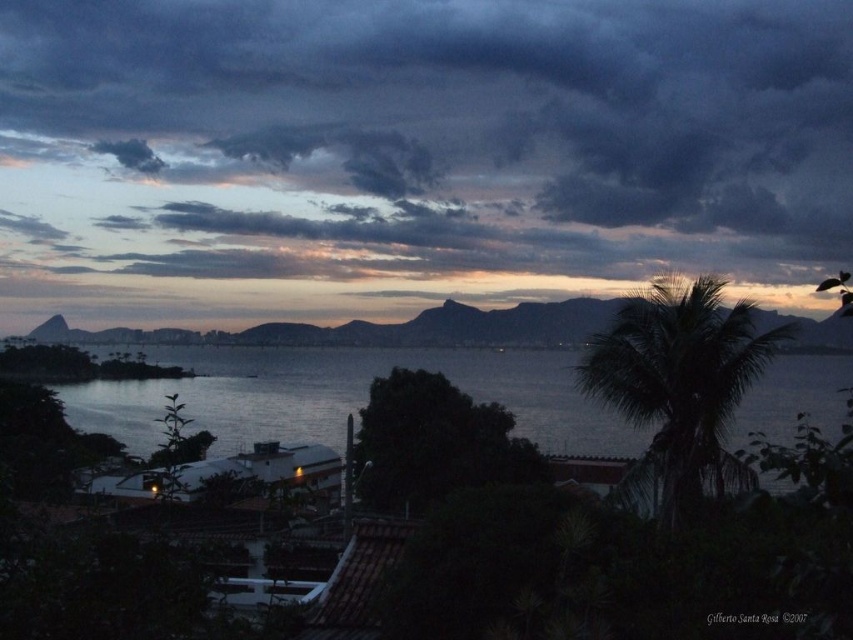
Question: Is dark gray cloud at upper center closer to the viewer compared to dark green leafy palm tree at right?

Choices:
 (A) yes
 (B) no

Answer: (B)

Question: Which point appears farthest from the camera in this image?

Choices:
 (A) tap(49, 337)
 (B) tap(634, 241)
 (C) tap(154, 420)

Answer: (B)

Question: Estimate the real-world distances between objects in this image. Which object is closer to the dark water at center?

Choices:
 (A) dark gray cloud at upper center
 (B) silvery metallic water at center

Answer: (B)

Question: Which point is farther to the camera?

Choices:
 (A) (61, 336)
 (B) (697, 372)
 (C) (267, 186)
 (D) (489, 384)

Answer: (C)

Question: Does dark water at center appear under silvery metallic water at center?

Choices:
 (A) no
 (B) yes

Answer: (B)

Question: Can you confirm if dark water at center is positioned above silvery metallic water at center?

Choices:
 (A) yes
 (B) no

Answer: (B)